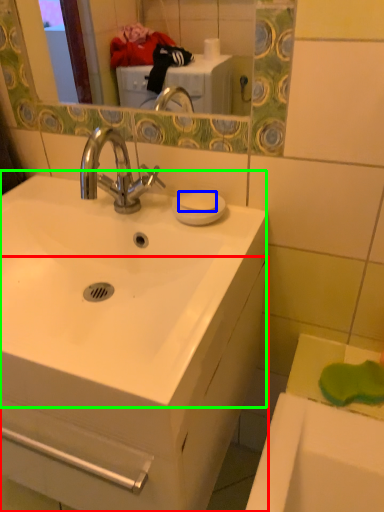
Question: Which is farther away from bathroom cabinet (highlighted by a red box)? soap (highlighted by a blue box) or sink (highlighted by a green box)?

Choices:
 (A) soap
 (B) sink

Answer: (A)